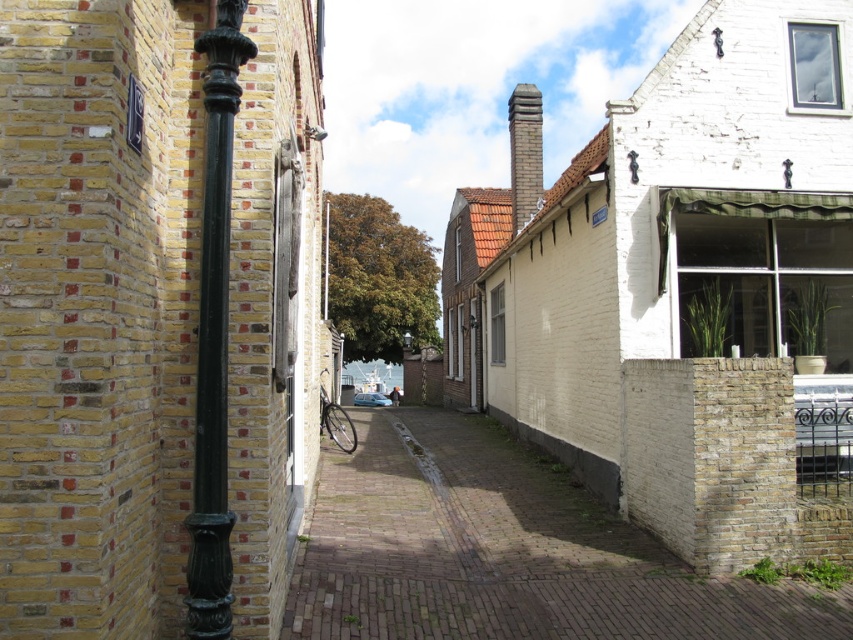
Question: Where is brick paved alley at center located in relation to green patinated metal pole at left in the image?

Choices:
 (A) left
 (B) right

Answer: (B)

Question: Is brick paved alley at center smaller than green patinated metal pole at left?

Choices:
 (A) no
 (B) yes

Answer: (A)

Question: Which point is farther from the camera taking this photo?

Choices:
 (A) (206, 490)
 (B) (427, 422)

Answer: (B)

Question: Is brick paved alley at center bigger than green patinated metal pole at left?

Choices:
 (A) yes
 (B) no

Answer: (A)